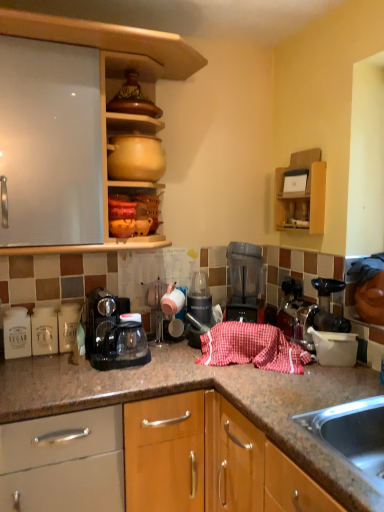
Question: Is translucent plastic blender at center wider or thinner than matte yellow clay pot at upper center, which is the 2th appliance in back-to-front order?

Choices:
 (A) wide
 (B) thin

Answer: (B)

Question: Looking at the image, does translucent plastic blender at center seem bigger or smaller compared to matte yellow clay pot at upper center, the second appliance when ordered from right to left?

Choices:
 (A) small
 (B) big

Answer: (B)

Question: Estimate the real-world distances between objects in this image. Which object is farther from the red checkered cloth at center?

Choices:
 (A) matte ceramic pots at upper center, the 2th cabinetry from the right
 (B) black plastic blender at center, arranged as the 2th appliance when viewed from the left
 (C) black plastic coffee maker at center
 (D) wooden shelf at upper right, which is counted as the 2th cabinetry, starting from the left
 (E) translucent plastic blender at center

Answer: (A)

Question: Estimate the real-world distances between objects in this image. Which object is farther from the red checkered cloth at center?

Choices:
 (A) black plastic coffee maker at center
 (B) matte ceramic pots at upper center, placed as the first cabinetry when sorted from left to right
 (C) translucent plastic blender at center
 (D) matte yellow clay pot at upper center, which is the 1th appliance from front to back
 (E) black plastic blender at center, the 2th appliance from the top

Answer: (B)